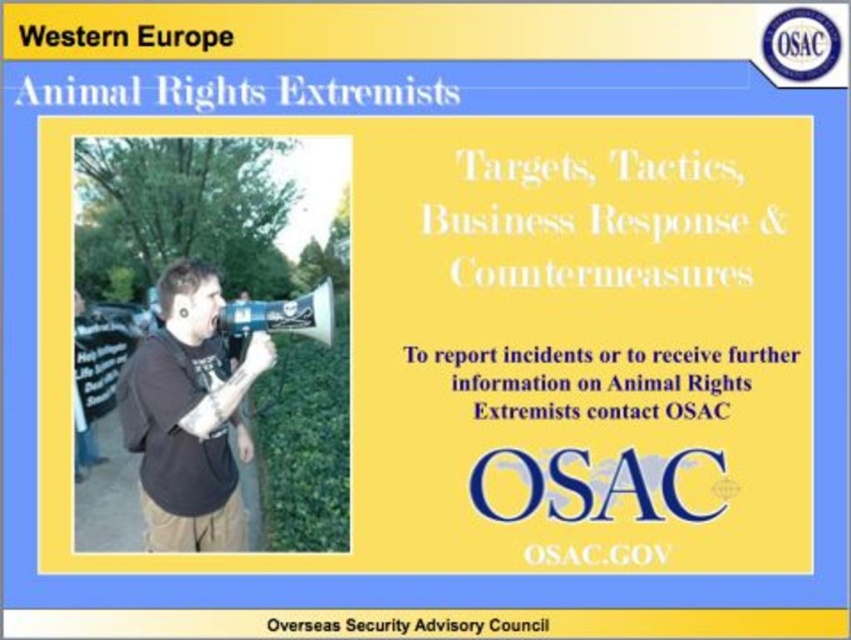
Question: Considering the relative positions of black matte megaphone at center and blue plastic megaphone at center in the image provided, where is black matte megaphone at center located with respect to blue plastic megaphone at center?

Choices:
 (A) left
 (B) right

Answer: (A)

Question: From the image, what is the correct spatial relationship of black matte megaphone at center in relation to blue plastic megaphone at center?

Choices:
 (A) below
 (B) above

Answer: (A)

Question: Among these objects, which one is farthest from the camera?

Choices:
 (A) blue plastic megaphone at center
 (B) black matte megaphone at center

Answer: (A)

Question: Which point appears farthest from the camera in this image?

Choices:
 (A) (206, 356)
 (B) (294, 305)

Answer: (A)

Question: Is black matte megaphone at center below blue plastic megaphone at center?

Choices:
 (A) no
 (B) yes

Answer: (B)